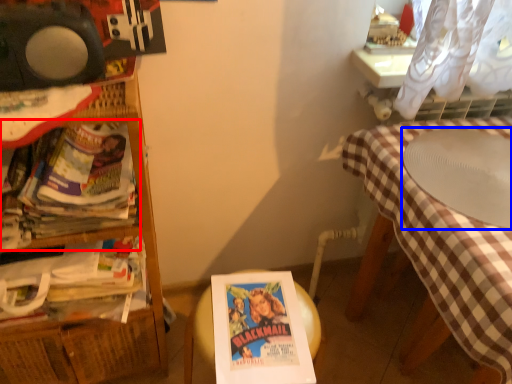
Question: Which of the following is the closest to the observer, book (highlighted by a red box) or round table (highlighted by a blue box)?

Choices:
 (A) book
 (B) round table

Answer: (A)